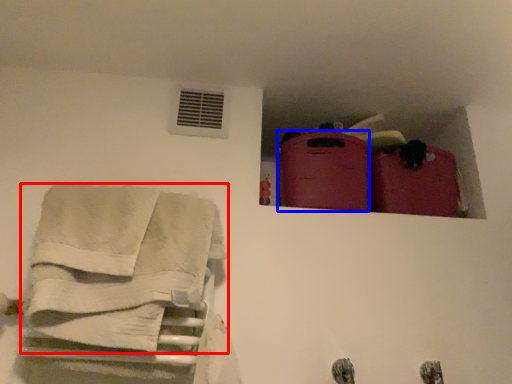
Question: Among these objects, which one is farthest to the camera, towel (highlighted by a red box) or luggage (highlighted by a blue box)?

Choices:
 (A) towel
 (B) luggage

Answer: (B)